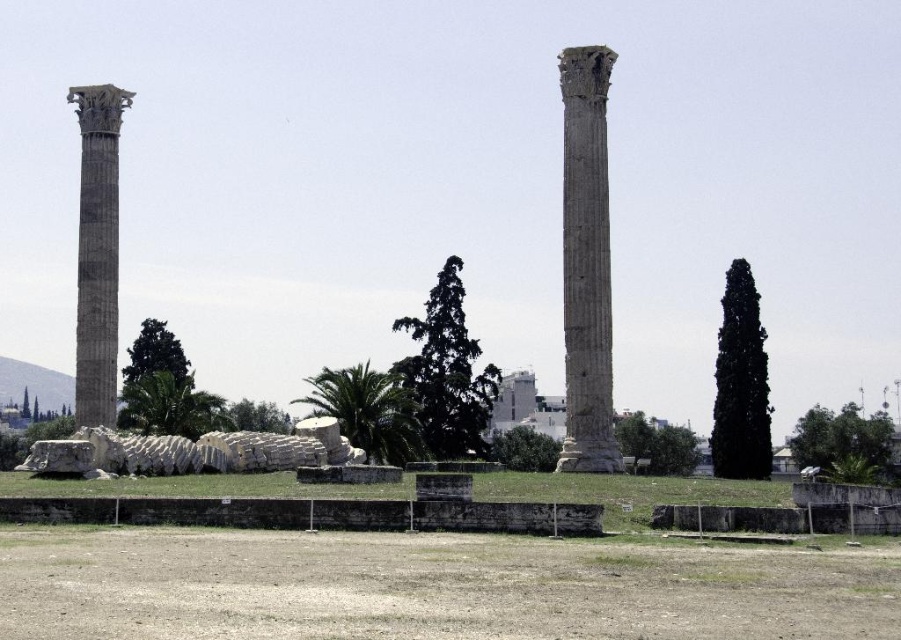
Between smooth stone column at center and marble column at left, which one has more height?

Standing taller between the two is smooth stone column at center.

Between smooth stone column at center and marble column at left, which one is positioned lower?

smooth stone column at center is below.

The image size is (901, 640). What are the coordinates of `smooth stone column at center` in the screenshot? It's located at (586, 262).